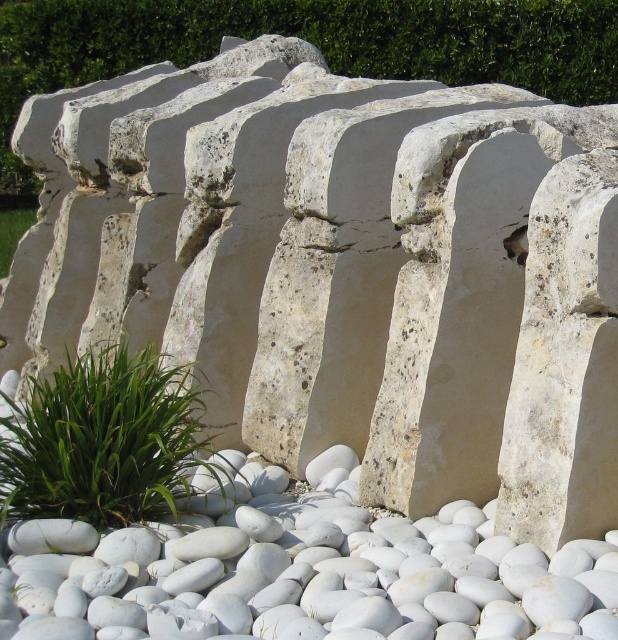
You are a landscape architect designing a garden pathway. You have to place a decorative stone between the white smooth pebble at center and the green leafy grass at lower left. Based on their sizes, which object should the stone be placed closer to?

The white smooth pebble at center might be wider than the green leafy grass at lower left, so the decorative stone should be placed closer to the white smooth pebble at center to maintain balance.